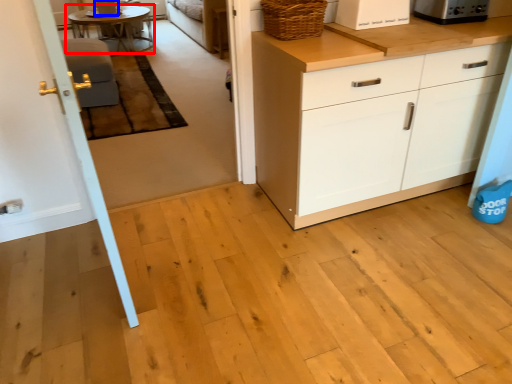
Question: Which object appears closest to the camera in this image, table (highlighted by a red box) or appliance (highlighted by a blue box)?

Choices:
 (A) table
 (B) appliance

Answer: (A)